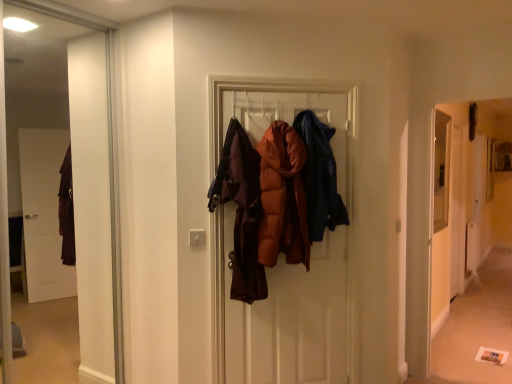
Find the location of a particular element. dark blue denim jacket at center, placed as the 2th garment when sorted from left to right is located at coordinates (319, 176).

Describe the element at coordinates (282, 197) in the screenshot. I see `matte brown puffer jacket at center, the 1th garment positioned from the left` at that location.

I want to click on dark blue denim jacket at center, the first garment when ordered from right to left, so click(319, 176).

Is matte brown puffer jacket at center, positioned as the 2th garment in right-to-left order, directly adjacent to transparent glass screen door at right?

No, matte brown puffer jacket at center, positioned as the 2th garment in right-to-left order, is not in contact with transparent glass screen door at right.

This screenshot has width=512, height=384. I want to click on screen door below the matte brown puffer jacket at center, positioned as the 2th garment in right-to-left order (from the image's perspective), so click(446, 216).

From a real-world perspective, which is physically below, matte brown puffer jacket at center, the 1th garment positioned from the left, or transparent glass screen door at right?

transparent glass screen door at right is physically lower.

Does matte brown puffer jacket at center, positioned as the 2th garment in right-to-left order, have a lesser width compared to transparent glass screen door at right?

In fact, matte brown puffer jacket at center, positioned as the 2th garment in right-to-left order, might be wider than transparent glass screen door at right.

Would you consider carpeted floor at lower right to be distant from transparent glass screen door at right?

carpeted floor at lower right is actually quite close to transparent glass screen door at right.

Identify the location of corridor in front of the transparent glass screen door at right. (470, 207).

Considering the relative sizes of carpeted floor at lower right and transparent glass screen door at right in the image provided, is carpeted floor at lower right taller than transparent glass screen door at right?

Yes.

In the scene shown: Could you tell me if carpeted floor at lower right is facing transparent glass screen door at right?

No, carpeted floor at lower right does not turn towards transparent glass screen door at right.

Considering the relative sizes of dark blue denim jacket at center, the first garment when ordered from right to left, and matte brown puffer jacket at center, the 1th garment positioned from the left, in the image provided, is dark blue denim jacket at center, the first garment when ordered from right to left, taller than matte brown puffer jacket at center, the 1th garment positioned from the left,?

No, dark blue denim jacket at center, the first garment when ordered from right to left, is not taller than matte brown puffer jacket at center, the 1th garment positioned from the left.

Is dark blue denim jacket at center, the first garment when ordered from right to left, spatially inside matte brown puffer jacket at center, positioned as the 2th garment in right-to-left order, or outside of it?

dark blue denim jacket at center, the first garment when ordered from right to left, is located beyond the bounds of matte brown puffer jacket at center, positioned as the 2th garment in right-to-left order.

Considering the positions of points (324, 180) and (293, 149), is point (324, 180) farther from camera compared to point (293, 149)?

Yes, it is.

Measure the distance from dark blue denim jacket at center, the first garment when ordered from right to left, to matte brown puffer jacket at center, the 1th garment positioned from the left.

dark blue denim jacket at center, the first garment when ordered from right to left, is 5.18 inches away from matte brown puffer jacket at center, the 1th garment positioned from the left.

In the scene shown: Is transparent glass screen door at right closer to camera compared to matte brown puffer jacket at center, positioned as the 2th garment in right-to-left order?

That is False.

Is point (456, 143) closer to viewer compared to point (289, 243)?

No, (456, 143) is behind (289, 243).

From the image's perspective, does transparent glass screen door at right appear higher than matte brown puffer jacket at center, positioned as the 2th garment in right-to-left order?

No, from the image's perspective, transparent glass screen door at right is not on top of matte brown puffer jacket at center, positioned as the 2th garment in right-to-left order.

From a real-world perspective, which is physically above, transparent glass screen door at right or carpeted floor at lower right?

carpeted floor at lower right.

From the image's perspective, would you say transparent glass screen door at right is positioned over carpeted floor at lower right?

Yes, from the image's perspective, transparent glass screen door at right is on top of carpeted floor at lower right.

Where is `screen door behind the carpeted floor at lower right`? The height and width of the screenshot is (384, 512). screen door behind the carpeted floor at lower right is located at coordinates (446, 216).

Considering the sizes of transparent glass screen door at right and carpeted floor at lower right in the image, is transparent glass screen door at right taller or shorter than carpeted floor at lower right?

Clearly, transparent glass screen door at right is shorter compared to carpeted floor at lower right.

From a real-world perspective, does matte brown puffer jacket at center, positioned as the 2th garment in right-to-left order, sit lower than carpeted floor at lower right?

No, from a real-world perspective, matte brown puffer jacket at center, positioned as the 2th garment in right-to-left order, is not below carpeted floor at lower right.

Which of these two, matte brown puffer jacket at center, positioned as the 2th garment in right-to-left order, or carpeted floor at lower right, is bigger?

matte brown puffer jacket at center, positioned as the 2th garment in right-to-left order.

Based on the photo, considering the relative positions of matte brown puffer jacket at center, the 1th garment positioned from the left, and carpeted floor at lower right in the image provided, is matte brown puffer jacket at center, the 1th garment positioned from the left, to the right of carpeted floor at lower right from the viewer's perspective?

Incorrect, matte brown puffer jacket at center, the 1th garment positioned from the left, is not on the right side of carpeted floor at lower right.

Is dark blue denim jacket at center, placed as the 2th garment when sorted from left to right, oriented towards carpeted floor at lower right?

No, dark blue denim jacket at center, placed as the 2th garment when sorted from left to right, is not aimed at carpeted floor at lower right.

Image resolution: width=512 pixels, height=384 pixels. Identify the location of corridor below the dark blue denim jacket at center, the first garment when ordered from right to left (from a real-world perspective). (470, 207).

Is dark blue denim jacket at center, the first garment when ordered from right to left, not near carpeted floor at lower right?

dark blue denim jacket at center, the first garment when ordered from right to left, is far away from carpeted floor at lower right.

Locate an element on the screen. screen door directly beneath the matte brown puffer jacket at center, the 1th garment positioned from the left (from a real-world perspective) is located at coordinates (446, 216).

There is a transparent glass screen door at right. Where is `corridor above it (from a real-world perspective)`? Image resolution: width=512 pixels, height=384 pixels. corridor above it (from a real-world perspective) is located at coordinates (470, 207).

From the image, which object appears to be nearer to dark blue denim jacket at center, the first garment when ordered from right to left, matte brown puffer jacket at center, the 1th garment positioned from the left, or carpeted floor at lower right?

Among the two, matte brown puffer jacket at center, the 1th garment positioned from the left, is located nearer to dark blue denim jacket at center, the first garment when ordered from right to left.

From the image, which object appears to be farther from carpeted floor at lower right, matte brown puffer jacket at center, the 1th garment positioned from the left, or dark blue denim jacket at center, the first garment when ordered from right to left?

Based on the image, matte brown puffer jacket at center, the 1th garment positioned from the left, appears to be further to carpeted floor at lower right.

From the image, which object appears to be farther from carpeted floor at lower right, dark blue denim jacket at center, placed as the 2th garment when sorted from left to right, or transparent glass screen door at right?

Among the two, dark blue denim jacket at center, placed as the 2th garment when sorted from left to right, is located further to carpeted floor at lower right.

Based on the photo, which object lies nearer to the anchor point matte brown puffer jacket at center, the 1th garment positioned from the left, transparent glass screen door at right or carpeted floor at lower right?

The object closer to matte brown puffer jacket at center, the 1th garment positioned from the left, is carpeted floor at lower right.

In the scene shown: Which object lies further to the anchor point matte brown puffer jacket at center, positioned as the 2th garment in right-to-left order, transparent glass screen door at right or dark blue denim jacket at center, placed as the 2th garment when sorted from left to right?

transparent glass screen door at right is positioned further to the anchor matte brown puffer jacket at center, positioned as the 2th garment in right-to-left order.

Estimate the real-world distances between objects in this image. Which object is further from dark blue denim jacket at center, the first garment when ordered from right to left, transparent glass screen door at right or carpeted floor at lower right?

carpeted floor at lower right is further to dark blue denim jacket at center, the first garment when ordered from right to left.

Estimate the real-world distances between objects in this image. Which object is closer to transparent glass screen door at right, matte brown puffer jacket at center, positioned as the 2th garment in right-to-left order, or dark blue denim jacket at center, placed as the 2th garment when sorted from left to right?

Based on the image, dark blue denim jacket at center, placed as the 2th garment when sorted from left to right, appears to be nearer to transparent glass screen door at right.

Considering their positions, is matte brown puffer jacket at center, positioned as the 2th garment in right-to-left order, positioned closer to transparent glass screen door at right than carpeted floor at lower right?

carpeted floor at lower right.

This screenshot has height=384, width=512. I want to click on garment between matte brown puffer jacket at center, positioned as the 2th garment in right-to-left order, and carpeted floor at lower right, in the horizontal direction, so click(x=319, y=176).

I want to click on garment between matte brown puffer jacket at center, the 1th garment positioned from the left, and transparent glass screen door at right in the front-back direction, so click(319, 176).

Locate an element on the screen. The width and height of the screenshot is (512, 384). corridor between dark blue denim jacket at center, the first garment when ordered from right to left, and transparent glass screen door at right, along the z-axis is located at coordinates (470, 207).

Locate an element on the screen. corridor located between matte brown puffer jacket at center, the 1th garment positioned from the left, and transparent glass screen door at right in the depth direction is located at coordinates (x=470, y=207).